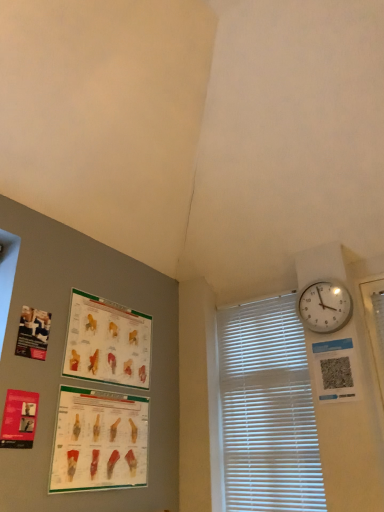
Question: Does matte paper poster at lower left, the first poster page positioned from the bottom, come in front of matte paper poster at left, the 1th poster page positioned from the top?

Choices:
 (A) yes
 (B) no

Answer: (A)

Question: Is matte paper poster at lower left, marked as the fourth poster page in a top-to-bottom arrangement, looking in the opposite direction of matte paper poster at left, the 1th poster page positioned from the top?

Choices:
 (A) yes
 (B) no

Answer: (B)

Question: From the image's perspective, would you say matte paper poster at lower left, the first poster page positioned from the bottom, is shown under matte paper poster at left, the 1th poster page positioned from the top?

Choices:
 (A) no
 (B) yes

Answer: (B)

Question: Is matte paper poster at left, the 1th poster page positioned from the top, completely or partially inside matte paper poster at lower left, marked as the fourth poster page in a top-to-bottom arrangement?

Choices:
 (A) no
 (B) yes

Answer: (A)

Question: Is matte paper poster at lower left, marked as the fourth poster page in a top-to-bottom arrangement, bigger than matte paper poster at left, which is counted as the fourth poster page, starting from the bottom?

Choices:
 (A) yes
 (B) no

Answer: (A)

Question: From a real-world perspective, is matte paper poster at lower left, the first poster page positioned from the bottom, located beneath matte paper poster at left, which is counted as the fourth poster page, starting from the bottom?

Choices:
 (A) yes
 (B) no

Answer: (A)

Question: From the image's perspective, is white plastic blinds at right located beneath matte paper poster at upper left, which is the second poster page from top to bottom?

Choices:
 (A) yes
 (B) no

Answer: (A)

Question: From the image's perspective, is white plastic blinds at right on top of matte paper poster at upper left, which is the second poster page from top to bottom?

Choices:
 (A) no
 (B) yes

Answer: (A)

Question: Considering the relative sizes of white plastic blinds at right and matte paper poster at upper left, positioned as the third poster page in bottom-to-top order, in the image provided, is white plastic blinds at right bigger than matte paper poster at upper left, positioned as the third poster page in bottom-to-top order,?

Choices:
 (A) yes
 (B) no

Answer: (A)

Question: Considering the relative sizes of white plastic blinds at right and matte paper poster at upper left, positioned as the third poster page in bottom-to-top order, in the image provided, is white plastic blinds at right wider than matte paper poster at upper left, positioned as the third poster page in bottom-to-top order,?

Choices:
 (A) yes
 (B) no

Answer: (A)

Question: From a real-world perspective, is white plastic blinds at right physically below matte paper poster at upper left, positioned as the third poster page in bottom-to-top order?

Choices:
 (A) no
 (B) yes

Answer: (B)

Question: Is white plastic blinds at right shorter than matte paper poster at upper left, positioned as the third poster page in bottom-to-top order?

Choices:
 (A) no
 (B) yes

Answer: (A)

Question: Does white plastic blinds at right have a greater width compared to matte paper poster at lower left, the first poster page positioned from the bottom?

Choices:
 (A) yes
 (B) no

Answer: (A)